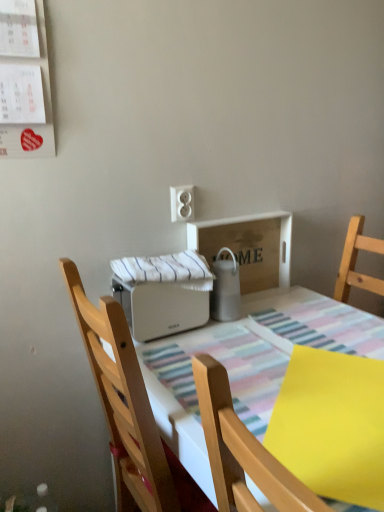
Where is `vacant area on top of white plastic toaster at center (from a real-world perspective)`? vacant area on top of white plastic toaster at center (from a real-world perspective) is located at coordinates (281, 361).